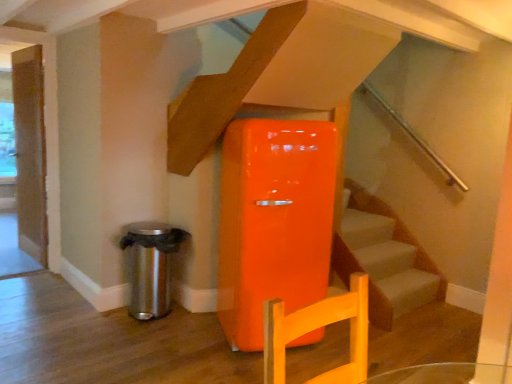
Question: Visually, is polished stainless steel trash can at lower left positioned to the left or to the right of wooden door at left?

Choices:
 (A) right
 (B) left

Answer: (A)

Question: From a real-world perspective, relative to wooden door at left, is polished stainless steel trash can at lower left vertically above or below?

Choices:
 (A) below
 (B) above

Answer: (A)

Question: In the image, is polished stainless steel trash can at lower left positioned in front of or behind wooden door at left?

Choices:
 (A) behind
 (B) front

Answer: (B)

Question: From a real-world perspective, relative to polished stainless steel trash can at lower left, is wooden door at left vertically above or below?

Choices:
 (A) above
 (B) below

Answer: (A)

Question: Considering the positions of point (27, 124) and point (140, 244), is point (27, 124) closer or farther from the camera than point (140, 244)?

Choices:
 (A) closer
 (B) farther

Answer: (B)

Question: From their relative heights in the image, would you say wooden door at left is taller or shorter than polished stainless steel trash can at lower left?

Choices:
 (A) short
 (B) tall

Answer: (B)

Question: In terms of width, does wooden door at left look wider or thinner when compared to polished stainless steel trash can at lower left?

Choices:
 (A) wide
 (B) thin

Answer: (B)